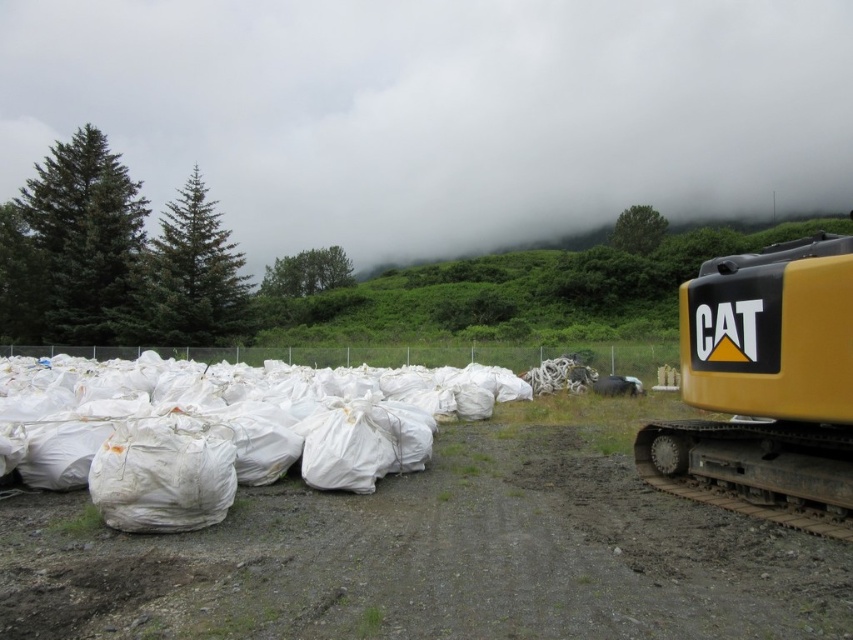
Question: Is dull brown dirt track at lower center below yellow rubber track at right?

Choices:
 (A) no
 (B) yes

Answer: (B)

Question: Which object is the closest to the white fabric bags at left?

Choices:
 (A) yellow rubber track at right
 (B) dull brown dirt track at lower center

Answer: (A)

Question: Which object is positioned closest to the yellow rubber track at right?

Choices:
 (A) white fabric bags at left
 (B) dull brown dirt track at lower center

Answer: (B)

Question: Can you confirm if dull brown dirt track at lower center is positioned above yellow rubber track at right?

Choices:
 (A) no
 (B) yes

Answer: (A)

Question: Does dull brown dirt track at lower center have a greater width compared to white fabric bags at left?

Choices:
 (A) no
 (B) yes

Answer: (A)

Question: Estimate the real-world distances between objects in this image. Which object is closer to the yellow rubber track at right?

Choices:
 (A) dull brown dirt track at lower center
 (B) white fabric bags at left

Answer: (A)